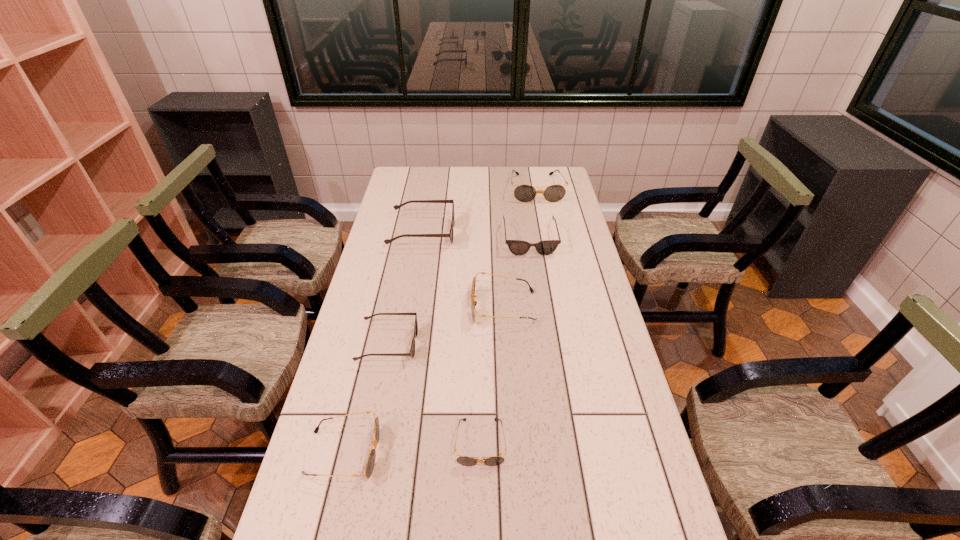
Point out which object is positioned as the third nearest to the nearest brown sunglasses. Please provide its 2D coordinates. Your answer should be formatted as a tuple, i.e. [(x, y)], where the tuple contains the x and y coordinates of a point satisfying the conditions above.

[(463, 460)]

Choose which object is the fifth nearest neighbor to the biggest brown sunglasses. Please provide its 2D coordinates. Your answer should be formatted as a tuple, i.e. [(x, y)], where the tuple contains the x and y coordinates of a point satisfying the conditions above.

[(463, 460)]

Select which sunglasses appears as the sixth closest to the biggest brown sunglasses. Please provide its 2D coordinates. Your answer should be formatted as a tuple, i.e. [(x, y)], where the tuple contains the x and y coordinates of a point satisfying the conditions above.

[(369, 466)]

Identify which sunglasses is the nearest to the nearest brown sunglasses. Please provide its 2D coordinates. Your answer should be formatted as a tuple, i.e. [(x, y)], where the tuple contains the x and y coordinates of a point satisfying the conditions above.

[(473, 303)]

Locate an element on the screen. This screenshot has width=960, height=540. black sunglasses identified as the third closest to the second farthest black sunglasses is located at coordinates (524, 193).

Where is `black sunglasses that stands as the second closest to the rightmost brown sunglasses`? This screenshot has height=540, width=960. black sunglasses that stands as the second closest to the rightmost brown sunglasses is located at coordinates click(x=473, y=303).

Point out which brown sunglasses is positioned as the second nearest to the smallest brown sunglasses. Please provide its 2D coordinates. Your answer should be formatted as a tuple, i.e. [(x, y)], where the tuple contains the x and y coordinates of a point satisfying the conditions above.

[(518, 247)]

Identify which brown sunglasses is located as the second nearest to the smallest black sunglasses. Please provide its 2D coordinates. Your answer should be formatted as a tuple, i.e. [(x, y)], where the tuple contains the x and y coordinates of a point satisfying the conditions above.

[(518, 247)]

Where is `vacant space that satisfies the following two spatial constraints: 1. on the front-facing side of the farthest sunglasses; 2. on the front-facing side of the leftmost black sunglasses`? The height and width of the screenshot is (540, 960). vacant space that satisfies the following two spatial constraints: 1. on the front-facing side of the farthest sunglasses; 2. on the front-facing side of the leftmost black sunglasses is located at coordinates [587, 453].

This screenshot has height=540, width=960. Identify the location of vacant position in the image that satisfies the following two spatial constraints: 1. on the front-facing side of the farthest sunglasses; 2. on the front-facing side of the second biggest black sunglasses. coord(559,307).